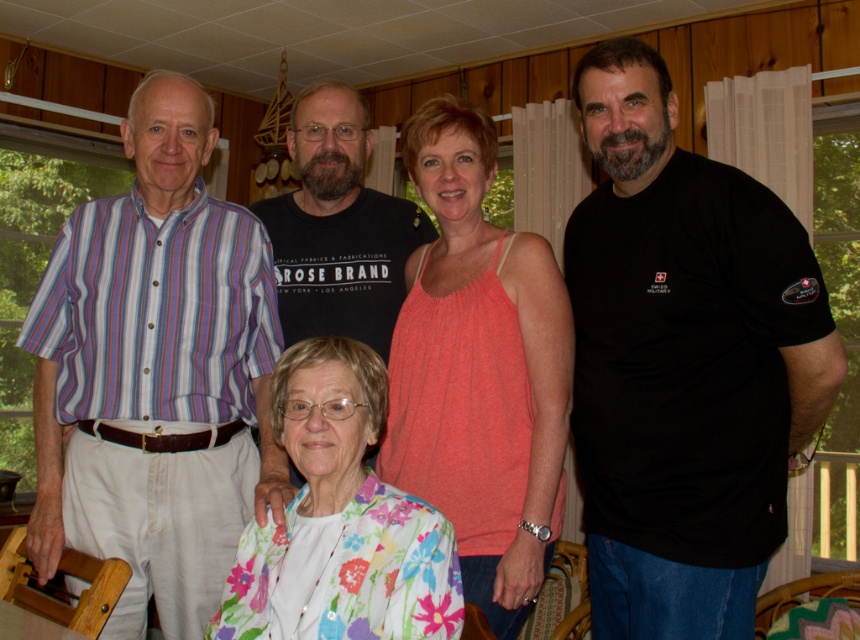
Question: Which of the following is the farthest from the observer?

Choices:
 (A) (482, 564)
 (B) (690, 305)

Answer: (A)

Question: Which object is positioned farthest from the black cotton t-shirt at center?

Choices:
 (A) black cotton t-shirt at right
 (B) matte coral tank top at center
 (C) striped cotton shirt at left
 (D) floral fabric blouse at lower center

Answer: (A)

Question: Can you confirm if matte coral tank top at center is bigger than black cotton t-shirt at center?

Choices:
 (A) no
 (B) yes

Answer: (B)

Question: Among these objects, which one is nearest to the camera?

Choices:
 (A) striped cotton shirt at left
 (B) black cotton t-shirt at right

Answer: (B)

Question: Is striped cotton shirt at left below matte coral tank top at center?

Choices:
 (A) yes
 (B) no

Answer: (B)

Question: Is striped cotton shirt at left positioned in front of matte coral tank top at center?

Choices:
 (A) no
 (B) yes

Answer: (B)